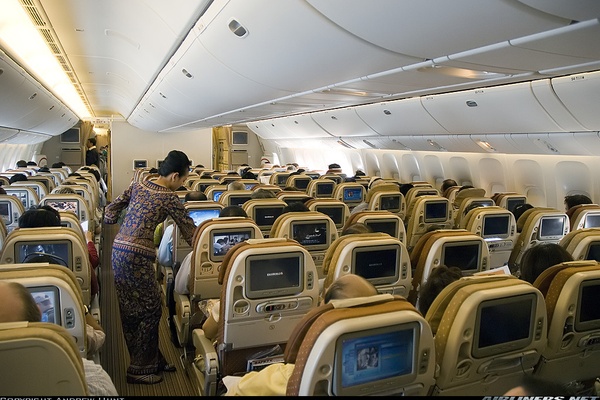
Where is `tvs turned on and viewing`? The width and height of the screenshot is (600, 400). tvs turned on and viewing is located at coordinates (368, 362), (226, 245), (195, 213), (51, 307), (52, 250), (67, 207).